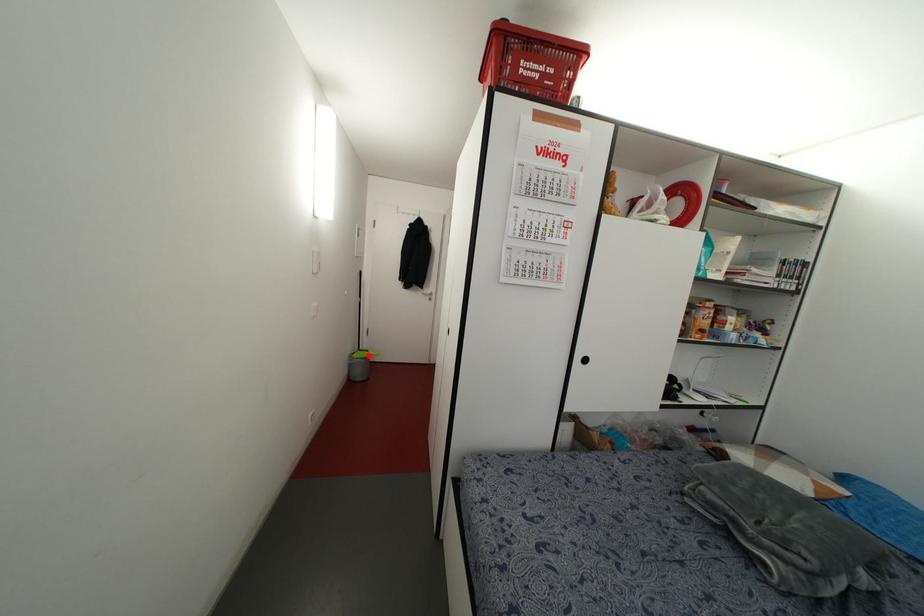
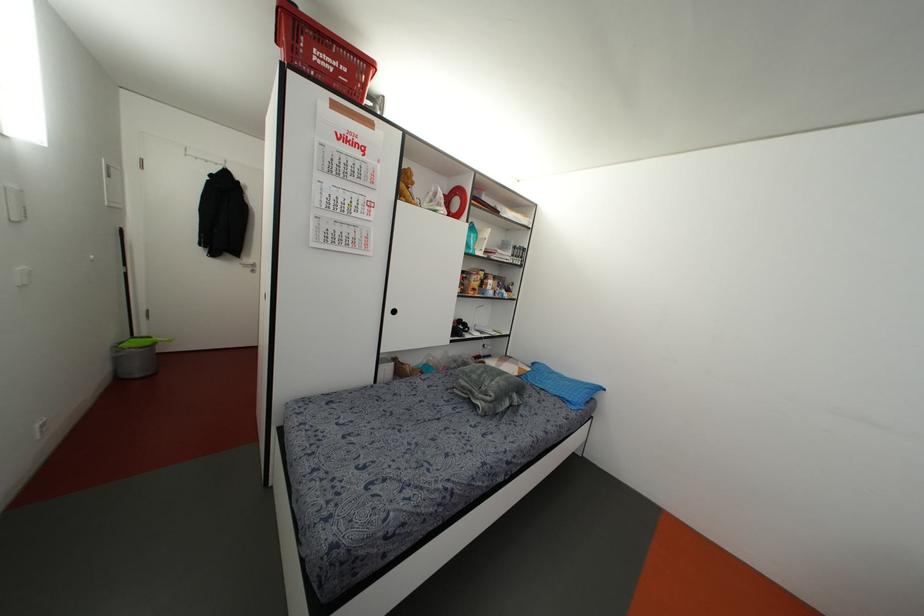
Question: I am providing you with two images of the same scene from different viewpoints. Given a red point in image1, look at the same physical point in image2. Is it:

Choices:
 (A) Closer to the viewpoint
 (B) Farther from the viewpoint

Answer: (B)